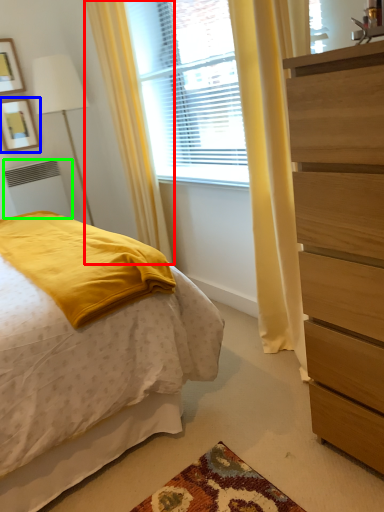
Question: Which is nearer to the curtain (highlighted by a red box)? picture frame (highlighted by a blue box) or radiator (highlighted by a green box).

Choices:
 (A) picture frame
 (B) radiator

Answer: (B)